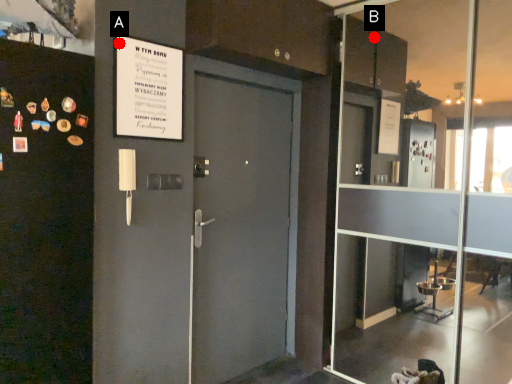
Question: Two points are circled on the image, labeled by A and B beside each circle. Which point appears closest to the camera in this image?

Choices:
 (A) A is closer
 (B) B is closer

Answer: (A)